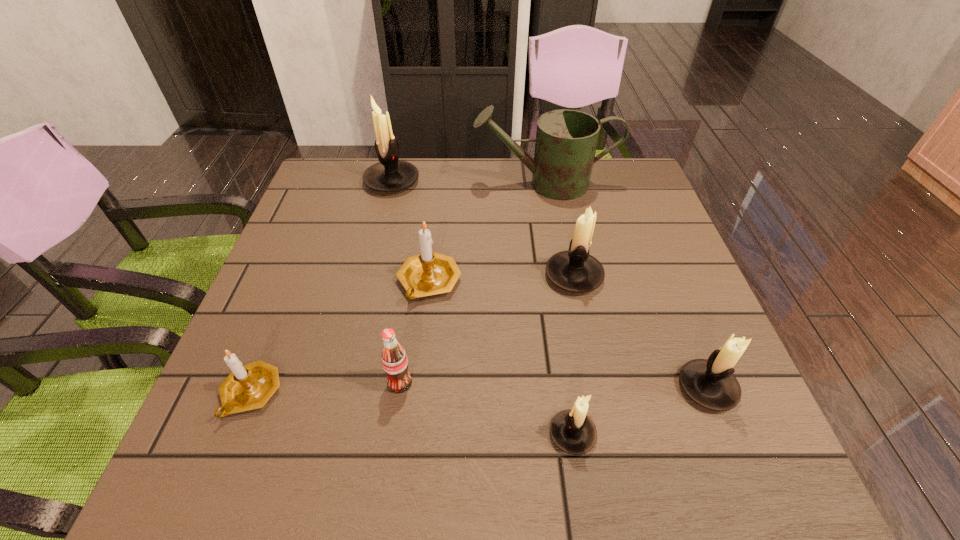
Identify which candle holder is the fifth nearest to the smallest white candle holder. Please provide its 2D coordinates. Your answer should be formatted as a tuple, i.e. [(x, y)], where the tuple contains the x and y coordinates of a point satisfying the conditions above.

[(390, 174)]

At what (x,y) coordinates should I click in order to perform the action: click on candle holder that is the second closest to the smallest white candle holder. Please return your answer as a coordinate pair (x, y). Looking at the image, I should click on (574, 270).

Find the location of a particular element. white candle holder that is the second nearest to the leftmost candle holder is located at coordinates (574, 270).

Point out which white candle holder is positioned as the second nearest to the right gold candle holder. Please provide its 2D coordinates. Your answer should be formatted as a tuple, i.e. [(x, y)], where the tuple contains the x and y coordinates of a point satisfying the conditions above.

[(390, 174)]

Image resolution: width=960 pixels, height=540 pixels. Identify the location of vacant space that satisfies the following two spatial constraints: 1. on the back side of the rightmost white candle holder; 2. with the spout on the green watering can. (626, 184).

Locate an element on the screen. free space in the image that satisfies the following two spatial constraints: 1. on the back side of the bigger gold candle holder; 2. on the left side of the soda is located at coordinates (415, 282).